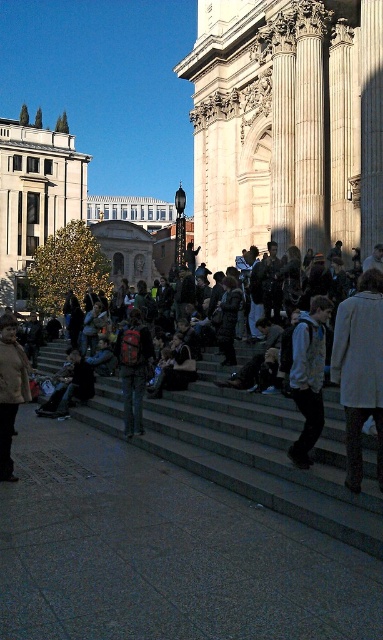
Who is shorter, concrete stairs at center or light gray coat at center?

concrete stairs at center

In the scene shown: Does concrete stairs at center appear on the right side of light gray coat at center?

No, concrete stairs at center is not to the right of light gray coat at center.

The width and height of the screenshot is (383, 640). What do you see at coordinates (265, 454) in the screenshot? I see `concrete stairs at center` at bounding box center [265, 454].

Identify the location of concrete stairs at center. (265, 454).

Does light blue denim jacket at center appear on the left side of matte brown coat at lower left?

In fact, light blue denim jacket at center is to the right of matte brown coat at lower left.

Does point (299, 410) lie in front of point (14, 353)?

Yes, point (299, 410) is in front of point (14, 353).

Locate an element on the screen. The height and width of the screenshot is (640, 383). light blue denim jacket at center is located at coordinates (309, 376).

Does light gray coat at center have a larger size compared to red backpack at center?

No.

Where is `light gray coat at center`? The image size is (383, 640). light gray coat at center is located at coordinates (360, 371).